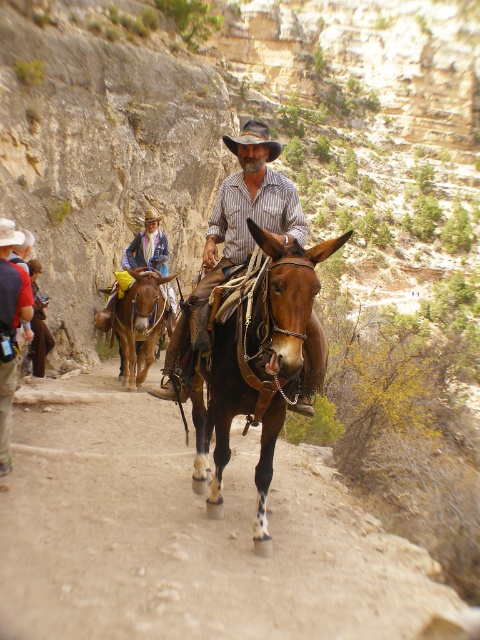
Based on the photo, measure the distance between brown leather donkey at center and brown leather mule at center.

A distance of 7.48 meters exists between brown leather donkey at center and brown leather mule at center.

Measure the distance between brown leather donkey at center and camera.

brown leather donkey at center and camera are 30.49 feet apart from each other.

Image resolution: width=480 pixels, height=640 pixels. I want to click on brown leather donkey at center, so click(x=255, y=369).

Who is positioned more to the left, rustic leather cowboy hat at center or brown leather cowboy hat at center?

rustic leather cowboy hat at center

Find the location of a particular element. Image resolution: width=480 pixels, height=640 pixels. rustic leather cowboy hat at center is located at coordinates (238, 230).

Where is `rustic leather cowboy hat at center`? Image resolution: width=480 pixels, height=640 pixels. rustic leather cowboy hat at center is located at coordinates (238, 230).

Where is `reddish-brown leather jacket at lower left`? This screenshot has width=480, height=640. reddish-brown leather jacket at lower left is located at coordinates point(38,323).

The image size is (480, 640). What do you see at coordinates (38, 323) in the screenshot?
I see `reddish-brown leather jacket at lower left` at bounding box center [38, 323].

This screenshot has height=640, width=480. Describe the element at coordinates (38, 323) in the screenshot. I see `reddish-brown leather jacket at lower left` at that location.

Find the location of a particular element. reddish-brown leather jacket at lower left is located at coordinates (38, 323).